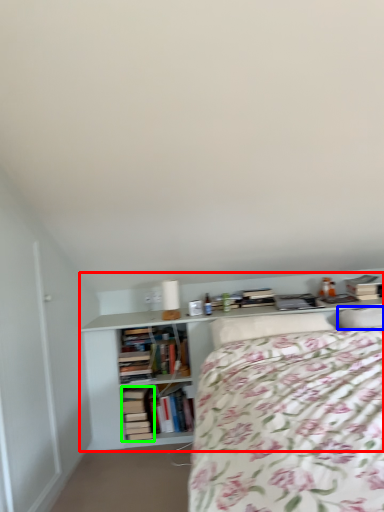
Question: Considering the real-world distances, which object is farthest from shelf (highlighted by a red box)? pillow (highlighted by a blue box) or book (highlighted by a green box)?

Choices:
 (A) pillow
 (B) book

Answer: (A)